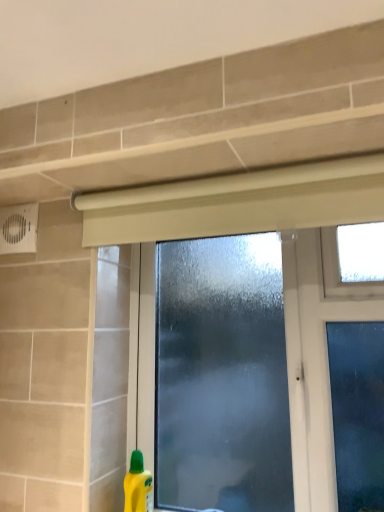
Question: Would you say yellow plastic bottle at lower left contains frosted glass window at center?

Choices:
 (A) yes
 (B) no

Answer: (B)

Question: Is yellow plastic bottle at lower left closer to the viewer compared to frosted glass window at center?

Choices:
 (A) yes
 (B) no

Answer: (B)

Question: Can you confirm if yellow plastic bottle at lower left is positioned to the right of frosted glass window at center?

Choices:
 (A) no
 (B) yes

Answer: (A)

Question: Are yellow plastic bottle at lower left and frosted glass window at center far apart?

Choices:
 (A) no
 (B) yes

Answer: (A)

Question: Are yellow plastic bottle at lower left and frosted glass window at center beside each other?

Choices:
 (A) no
 (B) yes

Answer: (A)

Question: Can you confirm if yellow plastic bottle at lower left is positioned to the left of frosted glass window at center?

Choices:
 (A) yes
 (B) no

Answer: (A)

Question: Is frosted glass window at center not near yellow plastic bottle at lower left?

Choices:
 (A) yes
 (B) no

Answer: (B)

Question: Is yellow plastic bottle at lower left surrounded by frosted glass window at center?

Choices:
 (A) no
 (B) yes

Answer: (A)

Question: From a real-world perspective, is frosted glass window at center under yellow plastic bottle at lower left?

Choices:
 (A) no
 (B) yes

Answer: (A)

Question: Can you confirm if frosted glass window at center is bigger than yellow plastic bottle at lower left?

Choices:
 (A) yes
 (B) no

Answer: (A)

Question: Is frosted glass window at center positioned before yellow plastic bottle at lower left?

Choices:
 (A) no
 (B) yes

Answer: (B)

Question: From a real-world perspective, does frosted glass window at center stand above yellow plastic bottle at lower left?

Choices:
 (A) yes
 (B) no

Answer: (A)

Question: Is point (261, 201) closer or farther from the camera than point (137, 483)?

Choices:
 (A) farther
 (B) closer

Answer: (B)